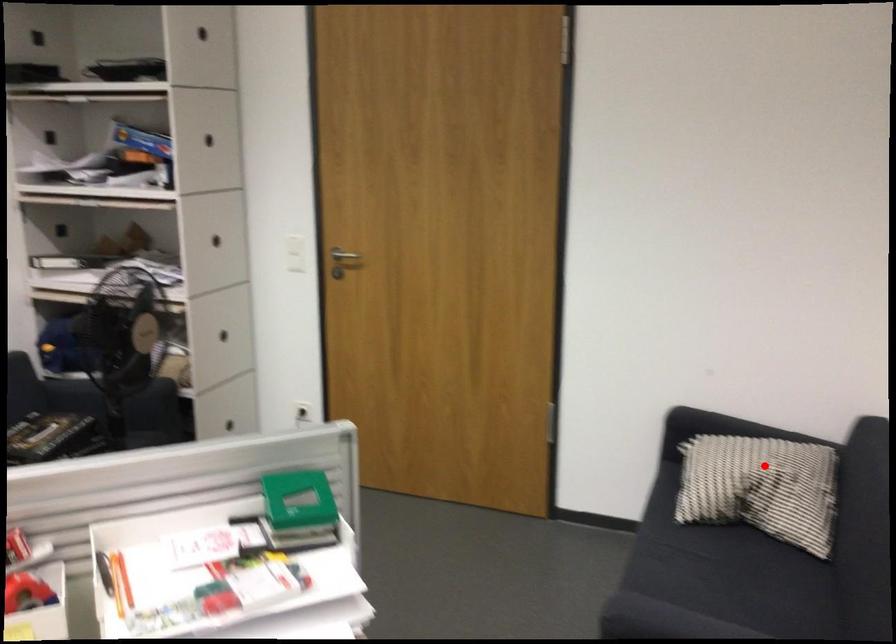
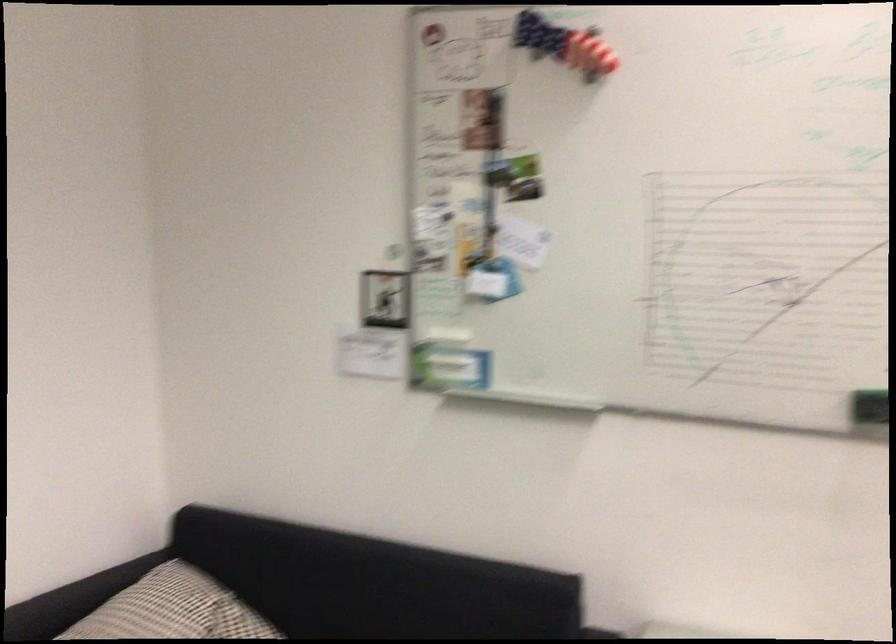
The point at the highlighted location is marked in the first image. Where is the corresponding point in the second image?

(193, 612)